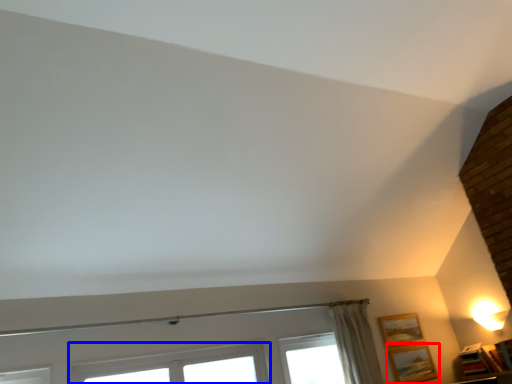
Question: Among these objects, which one is nearest to the camera, picture frame (highlighted by a red box) or window (highlighted by a blue box)?

Choices:
 (A) picture frame
 (B) window

Answer: (B)